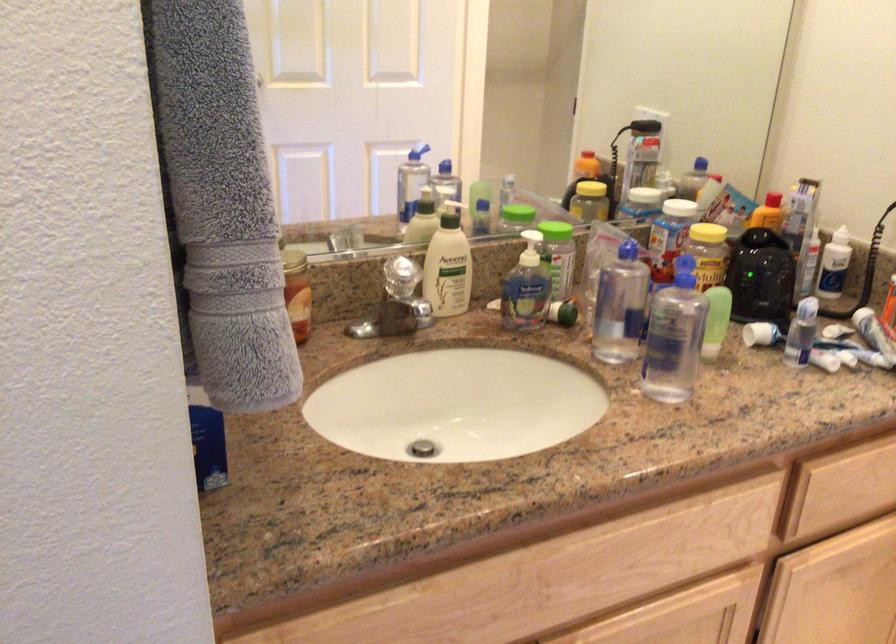
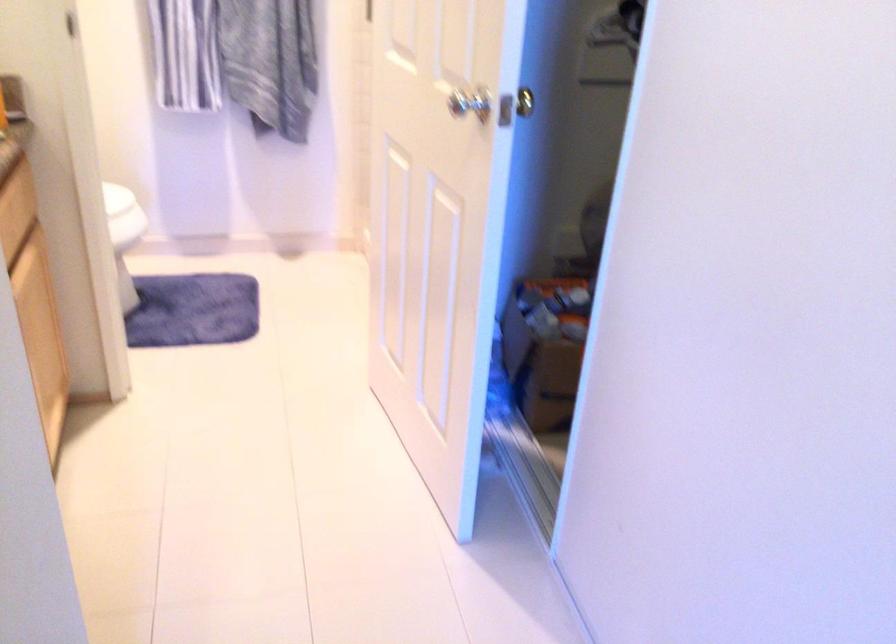
The first image is from the beginning of the video and the second image is from the end. How did the camera likely rotate when shooting the video?

The camera's rotation is toward right-down.